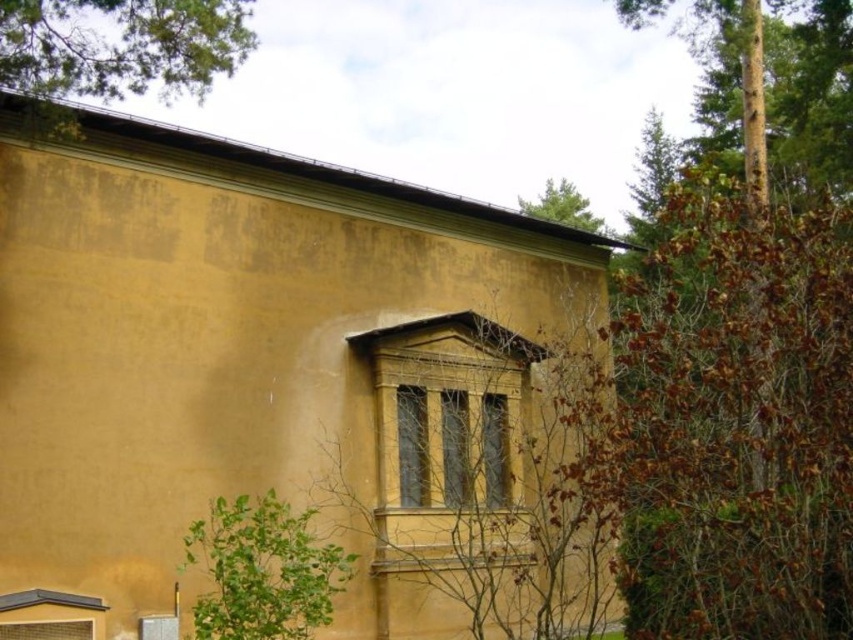
You are an architect analyzing the building facade. You notice two trees in the upper part of the image. Which tree has a greater width between the brown rough bark tree at upper right and the green leafy tree at upper center?

The brown rough bark tree at upper right has a greater width than the green leafy tree at upper center according to the description.

What are the coordinates of the green leafy tree at upper left?

The green leafy tree at upper left is located at coordinates point (115, 51).